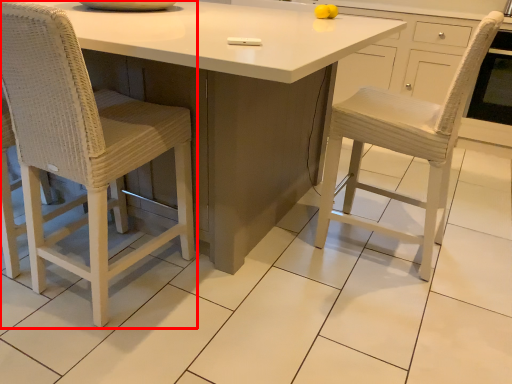
Question: Considering the relative positions of chair (annotated by the red box) and table in the image provided, where is chair (annotated by the red box) located with respect to the staircase?

Choices:
 (A) right
 (B) left

Answer: (A)